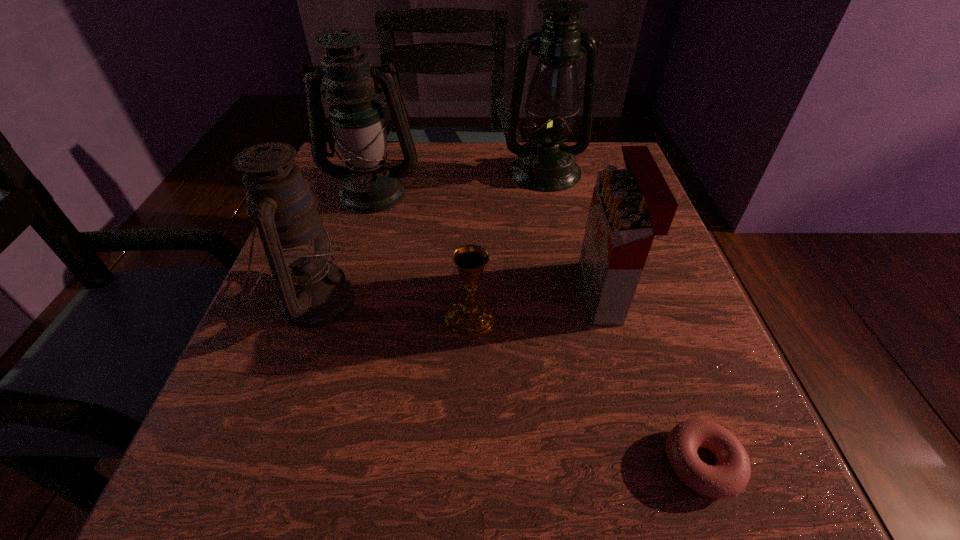
The image size is (960, 540). I want to click on object that is at the far right corner, so click(x=545, y=164).

Locate an element on the screen. This screenshot has width=960, height=540. object that is at the near right corner is located at coordinates (729, 477).

This screenshot has height=540, width=960. Identify the location of free space at the far edge of the desktop. (449, 155).

This screenshot has height=540, width=960. Find the location of `vacant space at the near edge of the desktop`. vacant space at the near edge of the desktop is located at coordinates (393, 484).

Where is `vacant space at the left edge of the desktop`? The height and width of the screenshot is (540, 960). vacant space at the left edge of the desktop is located at coordinates (324, 364).

This screenshot has height=540, width=960. In the image, there is a desktop. Find the location of `vacant space at the right edge`. vacant space at the right edge is located at coordinates (742, 428).

You are a GUI agent. You are given a task and a screenshot of the screen. Output one action in this format:
    pyautogui.click(x=<x>, y=<y>)
    Task: Click on the vacant space at the far right corner
    
    Given the screenshot: What is the action you would take?
    pyautogui.click(x=590, y=174)

Image resolution: width=960 pixels, height=540 pixels. Identify the location of vacant space at the near right corner. (649, 459).

Image resolution: width=960 pixels, height=540 pixels. In order to click on free spot between the shortest oil lamp and the fourth object from right to left in this screenshot , I will do `click(393, 308)`.

I want to click on vacant space in between the doughnut and the fourth tallest object, so click(x=653, y=377).